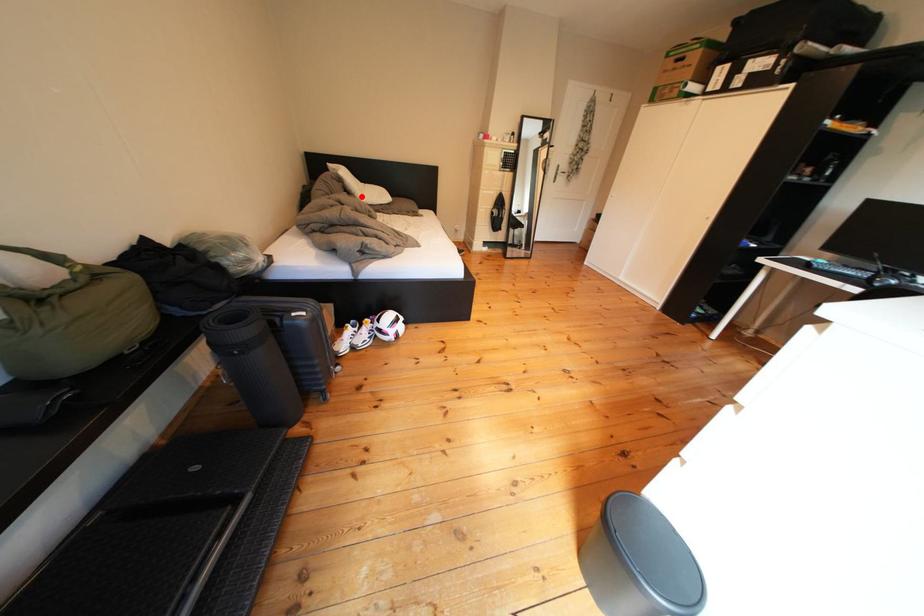
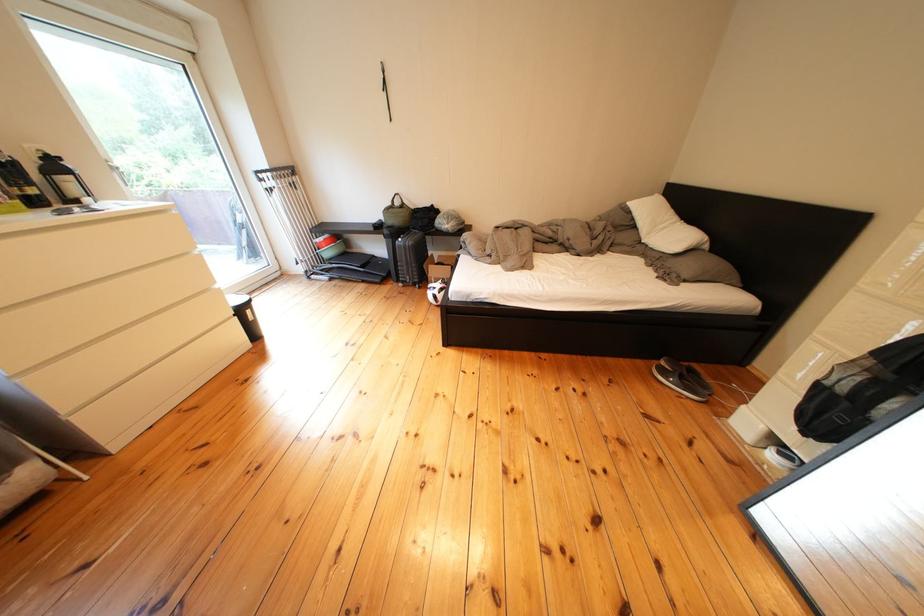
In the second image, find the point that corresponds to the highlighted location in the first image.

(649, 230)